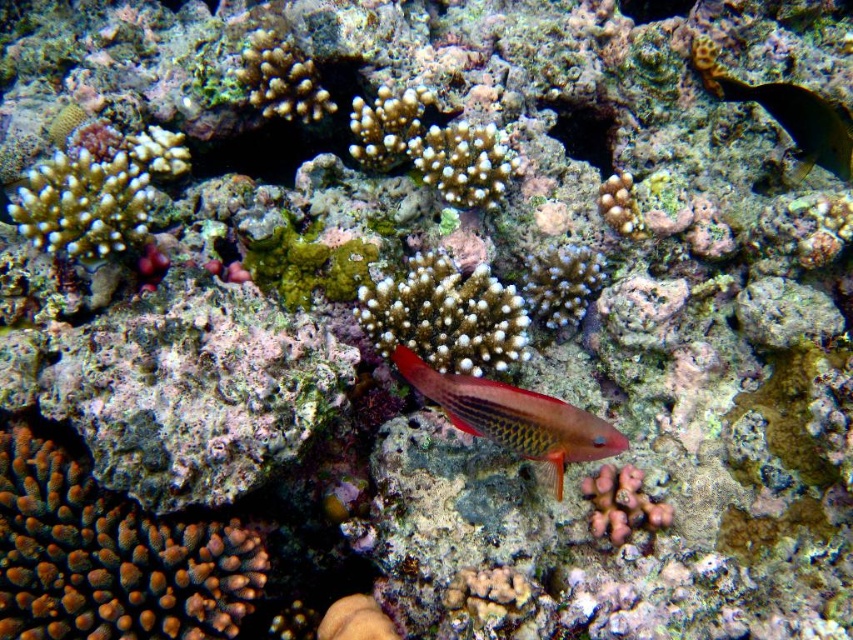
This screenshot has height=640, width=853. What do you see at coordinates (445, 316) in the screenshot?
I see `white coral at center` at bounding box center [445, 316].

Which is more to the left, white coral at center or shiny yellow fish at upper right?

→ white coral at center is more to the left.

At what (x,y) coordinates should I click in order to perform the action: click on white coral at center. Please return your answer as a coordinate pair (x, y). Image resolution: width=853 pixels, height=640 pixels. Looking at the image, I should click on (445, 316).

Is white coral at center further to camera compared to shiny red fish at center?

Yes, it is behind shiny red fish at center.

Which is in front, point (454, 280) or point (550, 464)?

Point (550, 464) is in front.

Measure the distance between white coral at center and camera.

The distance of white coral at center from camera is 1.80 meters.

You are a GUI agent. You are given a task and a screenshot of the screen. Output one action in this format:
    pyautogui.click(x=<x>, y=<y>)
    Task: Click on the white coral at center
    The width and height of the screenshot is (853, 640).
    Given the screenshot: What is the action you would take?
    pyautogui.click(x=445, y=316)

Between shiny red fish at center and shiny yellow fish at upper right, which one has less height?

Standing shorter between the two is shiny red fish at center.

Identify the location of shiny red fish at center. (514, 417).

The width and height of the screenshot is (853, 640). I want to click on shiny red fish at center, so click(514, 417).